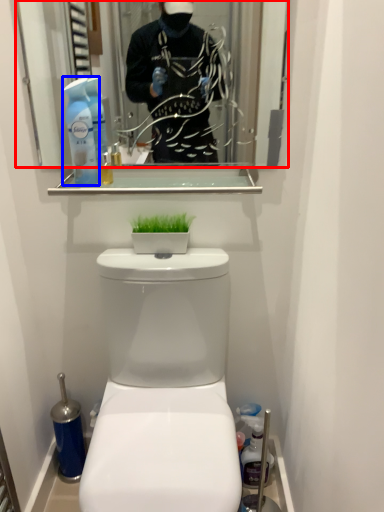
Question: Which point is further to the camera, mirror (highlighted by a red box) or cleaning product (highlighted by a blue box)?

Choices:
 (A) mirror
 (B) cleaning product

Answer: (A)